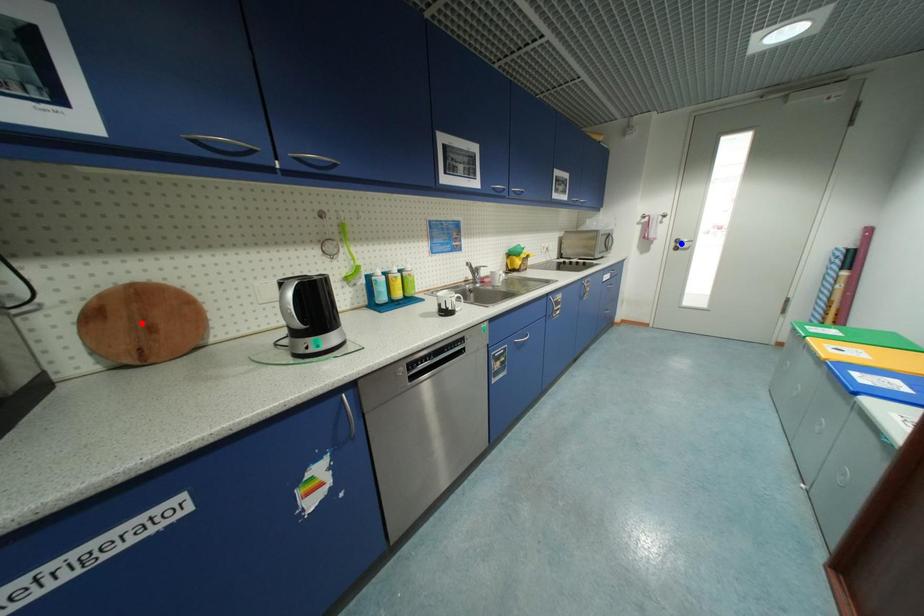
Question: Which of the two points in the image is closer to the camera?

Choices:
 (A) Blue point is closer.
 (B) Red point is closer.

Answer: (B)